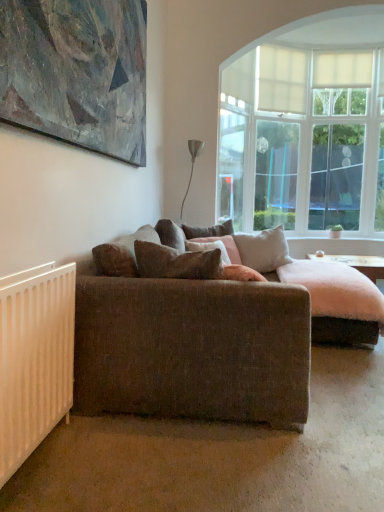
Question: Is textured brown couch at center completely or partially inside light beige fabric pillow at center, which is the 3th pillow in front-to-back order?

Choices:
 (A) no
 (B) yes

Answer: (A)

Question: Does light beige fabric pillow at center, arranged as the 2th pillow when viewed from the back, turn towards textured brown couch at center?

Choices:
 (A) yes
 (B) no

Answer: (B)

Question: Can you confirm if light beige fabric pillow at center, which is the 3th pillow in front-to-back order, is wider than textured brown couch at center?

Choices:
 (A) no
 (B) yes

Answer: (A)

Question: Are light beige fabric pillow at center, arranged as the 2th pillow when viewed from the back, and textured brown couch at center beside each other?

Choices:
 (A) no
 (B) yes

Answer: (A)

Question: Is light beige fabric pillow at center, which is the 3th pillow in front-to-back order, in front of textured brown couch at center?

Choices:
 (A) yes
 (B) no

Answer: (B)

Question: From the image's perspective, is light beige fabric pillow at center, arranged as the 2th pillow when viewed from the back, on textured brown couch at center?

Choices:
 (A) no
 (B) yes

Answer: (B)

Question: Can you confirm if white sheer curtain at upper center is taller than light beige fabric pillow at center, arranged as the 2th pillow when viewed from the back?

Choices:
 (A) yes
 (B) no

Answer: (A)

Question: Are white sheer curtain at upper center and light beige fabric pillow at center, which is the 3th pillow in front-to-back order, making contact?

Choices:
 (A) no
 (B) yes

Answer: (A)

Question: Does white sheer curtain at upper center appear on the right side of light beige fabric pillow at center, which is the 3th pillow in front-to-back order?

Choices:
 (A) yes
 (B) no

Answer: (A)

Question: Is white sheer curtain at upper center bigger than light beige fabric pillow at center, arranged as the 2th pillow when viewed from the back?

Choices:
 (A) no
 (B) yes

Answer: (A)

Question: Is white sheer curtain at upper center wider than light beige fabric pillow at center, which is the 3th pillow in front-to-back order?

Choices:
 (A) no
 (B) yes

Answer: (A)

Question: Could you tell me if white sheer curtain at upper center is turned towards light beige fabric pillow at center, arranged as the 2th pillow when viewed from the back?

Choices:
 (A) yes
 (B) no

Answer: (B)

Question: Is white matte radiator at lower left not inside light beige fabric pillow at center, arranged as the 2th pillow when viewed from the back?

Choices:
 (A) yes
 (B) no

Answer: (A)